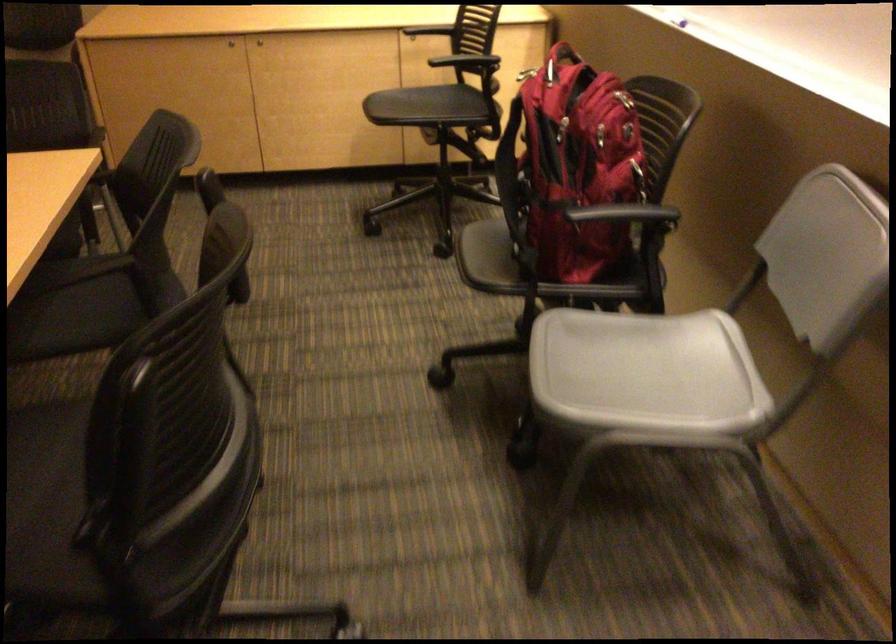
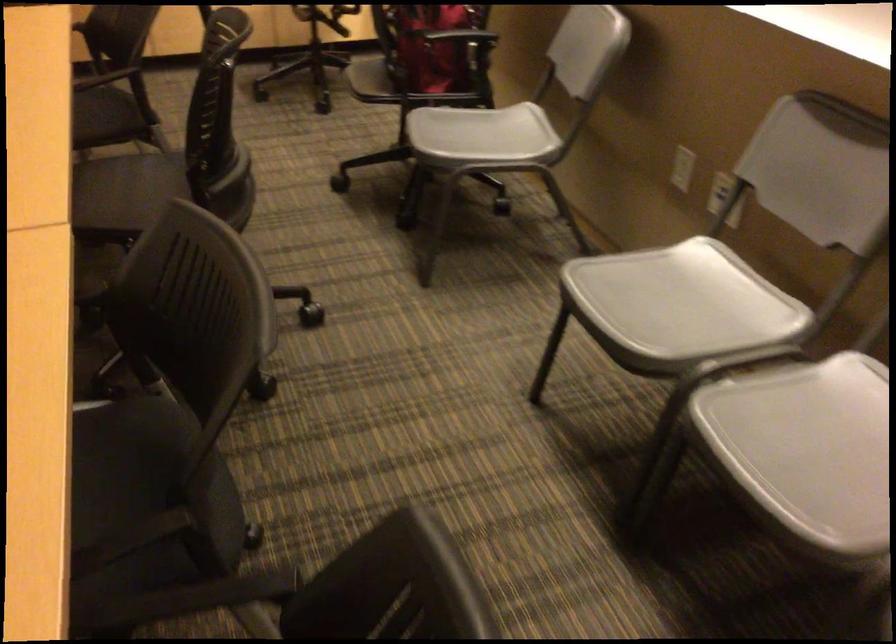
Find the pixel in the second image that matches point (119, 304) in the first image.

(100, 111)